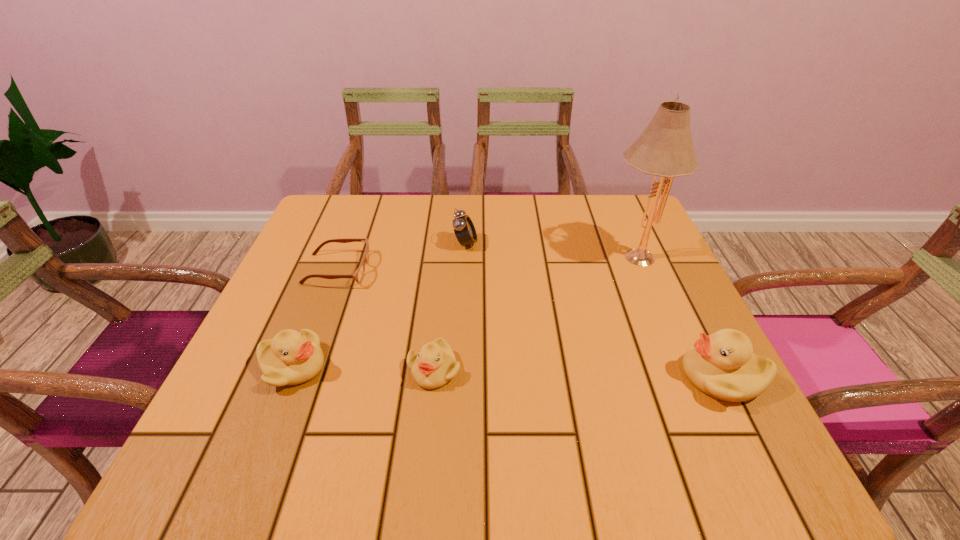
If the aim is uniform spacing by inserting an additional duckling among them, please point to a vacant space for this new duckling. Please provide its 2D coordinates. Your answer should be formatted as a tuple, i.e. [(x, y)], where the tuple contains the x and y coordinates of a point satisfying the conditions above.

[(577, 373)]